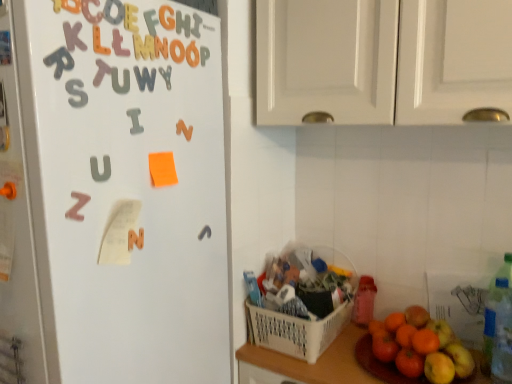
What is the approximate width of orange matte grapefruit at lower right?

orange matte grapefruit at lower right is 8.58 inches in width.

The height and width of the screenshot is (384, 512). I want to click on orange matte grapefruit at lower right, so (x=420, y=346).

Identify the location of white plastic basket at lower center. (296, 331).

You are a GUI agent. You are given a task and a screenshot of the screen. Output one action in this format:
    pyautogui.click(x=<x>, y=<y>)
    Task: Click on the cabinetry on the left of translucent plastic bottle at right
    The image size is (512, 384).
    Given the screenshot: What is the action you would take?
    pyautogui.click(x=383, y=60)

From the image's perspective, is translucent plastic bottle at right above white matte cabinet doors at upper center?

Incorrect, from the image's perspective, translucent plastic bottle at right is lower than white matte cabinet doors at upper center.

Which is more to the right, translucent plastic bottle at right or white matte cabinet doors at upper center?

Positioned to the right is translucent plastic bottle at right.

Is metallic silver letter at upper center, which is the seventh alphabet from left to right, at the right side of white matte cabinet doors at upper center?

No, metallic silver letter at upper center, which is the seventh alphabet from left to right, is not to the right of white matte cabinet doors at upper center.

How different are the orientations of metallic silver letter at upper center, which is the seventh alphabet from left to right, and white matte cabinet doors at upper center in degrees?

89.3 degrees.

Is metallic silver letter at upper center, which is the seventh alphabet from left to right, positioned with its back to white matte cabinet doors at upper center?

That's not correct — metallic silver letter at upper center, which is the seventh alphabet from left to right, is not looking away from white matte cabinet doors at upper center.

Image resolution: width=512 pixels, height=384 pixels. Find the location of `the 1st alphabet below when counting from the matte plastic letter at upper center, placed as the 6th alphabet when sorted from right to left (from the image's perspective)`. the 1st alphabet below when counting from the matte plastic letter at upper center, placed as the 6th alphabet when sorted from right to left (from the image's perspective) is located at coordinates (119, 82).

Is matte plastic letter at upper center, the fifth alphabet when ordered from top to bottom, in front of or behind orange matte letter u at upper center, which is counted as the third alphabet, starting from the left, in the image?

In the image, matte plastic letter at upper center, the fifth alphabet when ordered from top to bottom, appears in front of orange matte letter u at upper center, which is counted as the third alphabet, starting from the left.

Which is more to the right, matte plastic letter at upper center, placed as the 6th alphabet when sorted from right to left, or orange matte letter u at upper center, arranged as the second alphabet when ordered from the bottom?

orange matte letter u at upper center, arranged as the second alphabet when ordered from the bottom, is more to the right.

Is matte plastic letter at upper center, positioned as the 3th alphabet in bottom-to-top order, next to orange matte letter u at upper center, marked as the 6th alphabet in a top-to-bottom arrangement, and touching it?

Yes, matte plastic letter at upper center, positioned as the 3th alphabet in bottom-to-top order, is with orange matte letter u at upper center, marked as the 6th alphabet in a top-to-bottom arrangement.

Choose the correct answer: Is yellow foam letter e at upper center, the sixth alphabet from the bottom, inside translucent plastic bottle at right or outside it?

yellow foam letter e at upper center, the sixth alphabet from the bottom, is outside translucent plastic bottle at right.

Does yellow foam letter e at upper center, the 4th alphabet viewed from the right, turn towards translucent plastic bottle at right?

No, yellow foam letter e at upper center, the 4th alphabet viewed from the right, is not oriented towards translucent plastic bottle at right.

From the image's perspective, is yellow foam letter e at upper center, the 4th alphabet viewed from the right, beneath translucent plastic bottle at right?

No, from the image's perspective, yellow foam letter e at upper center, the 4th alphabet viewed from the right, is not below translucent plastic bottle at right.

How much distance is there between yellow foam letter e at upper center, the sixth alphabet from the bottom, and translucent plastic bottle at right?

yellow foam letter e at upper center, the sixth alphabet from the bottom, and translucent plastic bottle at right are 1.13 meters apart.

Is the surface of orange matte letter u at upper center, marked as the 6th alphabet in a top-to-bottom arrangement, in direct contact with white magnetic letters at left?

No, orange matte letter u at upper center, marked as the 6th alphabet in a top-to-bottom arrangement, is not making contact with white magnetic letters at left.

Between orange matte letter u at upper center, which is counted as the third alphabet, starting from the left, and white magnetic letters at left, which one has more height?

Standing taller between the two is white magnetic letters at left.

Considering the positions of objects orange matte letter u at upper center, which is counted as the third alphabet, starting from the left, and white magnetic letters at left in the image provided, who is more to the left, orange matte letter u at upper center, which is counted as the third alphabet, starting from the left, or white magnetic letters at left?

From the viewer's perspective, white magnetic letters at left appears more on the left side.

Is white magnetic letters at left at the back of orange matte letter u at upper center, which is counted as the third alphabet, starting from the left?

Absolutely, orange matte letter u at upper center, which is counted as the third alphabet, starting from the left, is directed away from white magnetic letters at left.

At what (x,y) coordinates should I click in order to perform the action: click on letter above the white magnetic letters at left (from the image's perspective). Please return your answer as a coordinate pair (x, y). Looking at the image, I should click on (204, 55).

From the image's perspective, is white magnetic letters at left positioned above or below orange paper at upper center?

Clearly, from the image's perspective, white magnetic letters at left is below orange paper at upper center.

Is white magnetic letters at left touching orange paper at upper center?

No, white magnetic letters at left is not in contact with orange paper at upper center.

Which of these two, white magnetic letters at left or orange paper at upper center, is wider?

Wider between the two is white magnetic letters at left.

Would you say translucent plastic bottle at right contains orange matte grapefruit at lower right?

No, orange matte grapefruit at lower right is not inside translucent plastic bottle at right.

Is translucent plastic bottle at right facing towards orange matte grapefruit at lower right?

No, translucent plastic bottle at right is not oriented towards orange matte grapefruit at lower right.

Would you consider translucent plastic bottle at right to be distant from orange matte grapefruit at lower right?

No, translucent plastic bottle at right is in close proximity to orange matte grapefruit at lower right.

This screenshot has width=512, height=384. What are the coordinates of `bottle that appears below the white matte cabinet doors at upper center (from a real-world perspective)` in the screenshot? It's located at (499, 324).

In order to click on cabinetry that appears in front of the metallic silver letter at upper center, which ranks as the first alphabet in right-to-left order in this screenshot , I will do click(383, 60).

When comparing their distances from white magnetic letters at left, does translucent plastic bottle at right or orange matte grapefruit at lower right seem closer?

Based on the image, orange matte grapefruit at lower right appears to be nearer to white magnetic letters at left.

From the picture: Considering their positions, is white plastic basket at lower center positioned closer to white magnetic letters at left than metallic orange letter at upper center, positioned as the 3th alphabet in right-to-left order?

Based on the image, metallic orange letter at upper center, positioned as the 3th alphabet in right-to-left order, appears to be nearer to white magnetic letters at left.

Looking at the image, which one is located further to matte plastic letter at upper center, placed as the second alphabet when sorted from left to right, yellow foam letter e at upper center, the 4th alphabet positioned from the left, or orange matte grapefruit at lower right?

The object further to matte plastic letter at upper center, placed as the second alphabet when sorted from left to right, is orange matte grapefruit at lower right.

Estimate the real-world distances between objects in this image. Which object is closer to white matte cabinet doors at upper center, orange paper at upper center or translucent plastic bottle at right?

orange paper at upper center lies closer to white matte cabinet doors at upper center than the other object.

Based on their spatial positions, is white matte cabinet doors at upper center or white plastic basket at lower center further from yellow foam letter e at upper center, the 4th alphabet viewed from the right?

Among the two, white plastic basket at lower center is located further to yellow foam letter e at upper center, the 4th alphabet viewed from the right.

Estimate the real-world distances between objects in this image. Which object is closer to white matte cabinet doors at upper center, white plastic basket at lower center or orange matte grapefruit at lower right?

white plastic basket at lower center.

Estimate the real-world distances between objects in this image. Which object is further from metallic orange letter at upper center, the fifth alphabet when ordered from left to right, white plastic basket at lower center or white matte cabinet doors at upper center?

The object further to metallic orange letter at upper center, the fifth alphabet when ordered from left to right, is white plastic basket at lower center.

Considering their positions, is orange matte grapefruit at lower right positioned further to translucent plastic bottle at right than orange paper at upper center?

orange paper at upper center.

Where is `bottle between metallic silver letter at upper center, which ranks as the first alphabet in right-to-left order, and white plastic basket at lower center vertically`? This screenshot has height=384, width=512. bottle between metallic silver letter at upper center, which ranks as the first alphabet in right-to-left order, and white plastic basket at lower center vertically is located at coordinates (499, 324).

In order to click on letter located between orange matte letter u at upper center, marked as the 6th alphabet in a top-to-bottom arrangement, and white matte cabinet doors at upper center in the left-right direction in this screenshot , I will do `click(204, 55)`.

Locate an element on the screen. letter situated between white magnetic letters at left and orange matte grapefruit at lower right from left to right is located at coordinates (204, 55).

Identify the location of basket between orange matte letter at upper center, positioned as the 2th alphabet in right-to-left order, and translucent plastic bottle at right from left to right. (296, 331).